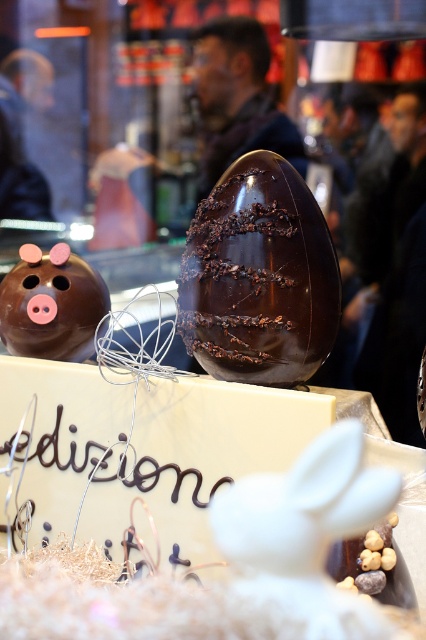
Based on the scene description, where is the chocolateshinyegg at center located in terms of its 2D coordinates?

The chocolateshinyegg at center is located at the 2D coordinates point (x=259, y=276).

You are a customer at a bakery and want to pick up the chocolateshinyegg at center and the matte chocolate piggy bank at left. Which one do you need to reach forward more to grab?

You need to reach forward more to grab the matte chocolate piggy bank at left because the chocolateshinyegg at center is closer to the viewer, while the matte chocolate piggy bank at left is further away.